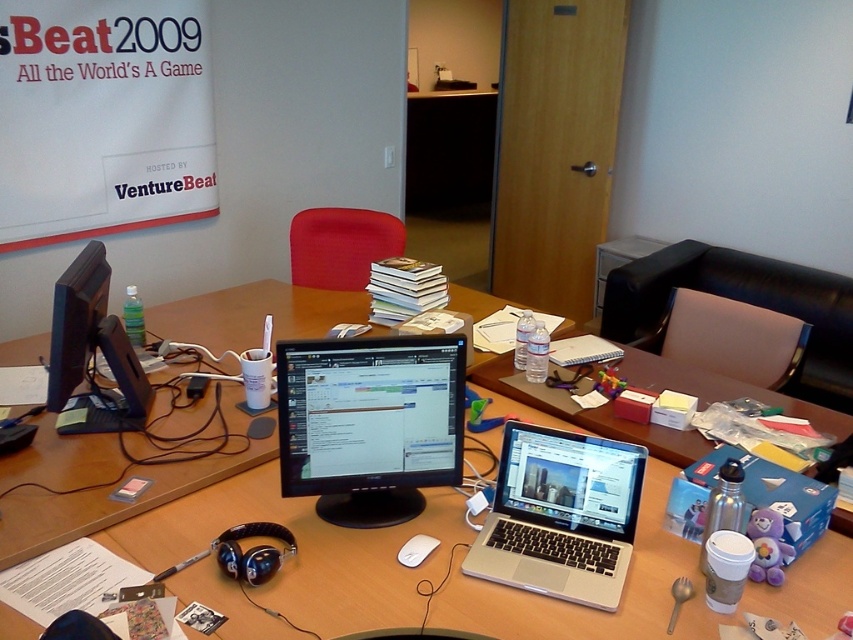
You are a delivery person who needs to place a package on the wooden table at center. The package is 4 feet long. Can you fit it on the table without overlapping the edges?

The wooden table at center has a length of 4.33 feet, so the 4 feet long package can be placed on it without overlapping the edges since it is shorter than the table length.

You are an office worker who needs to place a new document organizer on the desk. The organizer requires 30 cm of space in front of the black glossy monitor at center. Can you determine if there is enough space on the wooden table at center for this?

The wooden table at center is in front of the black glossy monitor at center, but the description does not specify the distance between them. Therefore, it is unclear if there is sufficient space for the document organizer requiring 30 cm of space in front of the monitor.

You are standing at the point with coordinates point [242,522] in the workspace. What object are you standing on?

The point [242,522] corresponds to the wooden table at center.